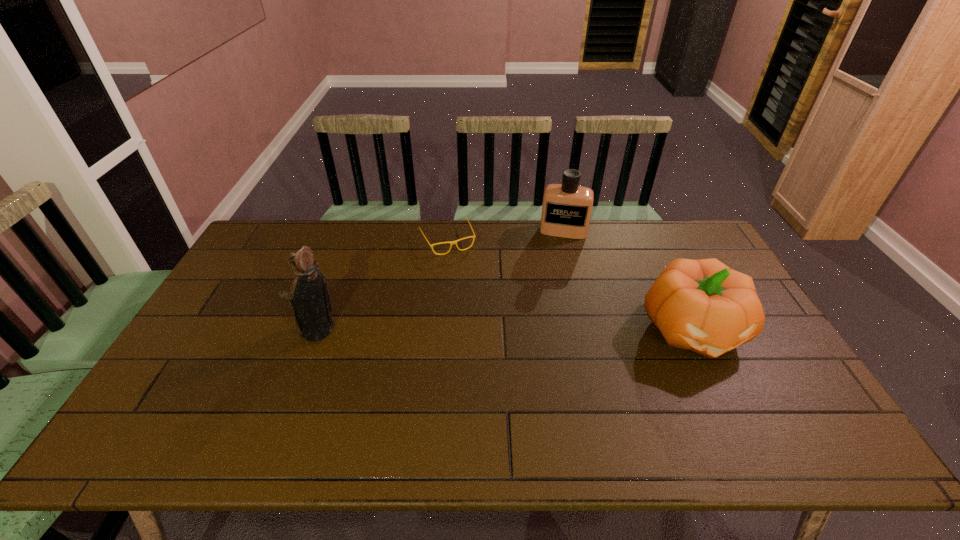
I want to click on empty space that is in between the third object from right to left and the rightmost object, so click(x=570, y=285).

In order to click on vacant area that lies between the rightmost object and the perfume in this screenshot , I will do `click(628, 280)`.

Locate an element on the screen. vacant area between the shortest object and the rightmost object is located at coordinates (570, 285).

Find the location of a particular element. The height and width of the screenshot is (540, 960). vacant space that's between the pumpkin and the perfume is located at coordinates (628, 280).

Identify the location of free space between the figurine and the spectacles. (382, 285).

Locate which object ranks in proximity to the spectacles. Please provide its 2D coordinates. Your answer should be formatted as a tuple, i.e. [(x, y)], where the tuple contains the x and y coordinates of a point satisfying the conditions above.

[(566, 210)]

Point out which object is positioned as the second nearest to the tallest object. Please provide its 2D coordinates. Your answer should be formatted as a tuple, i.e. [(x, y)], where the tuple contains the x and y coordinates of a point satisfying the conditions above.

[(566, 210)]